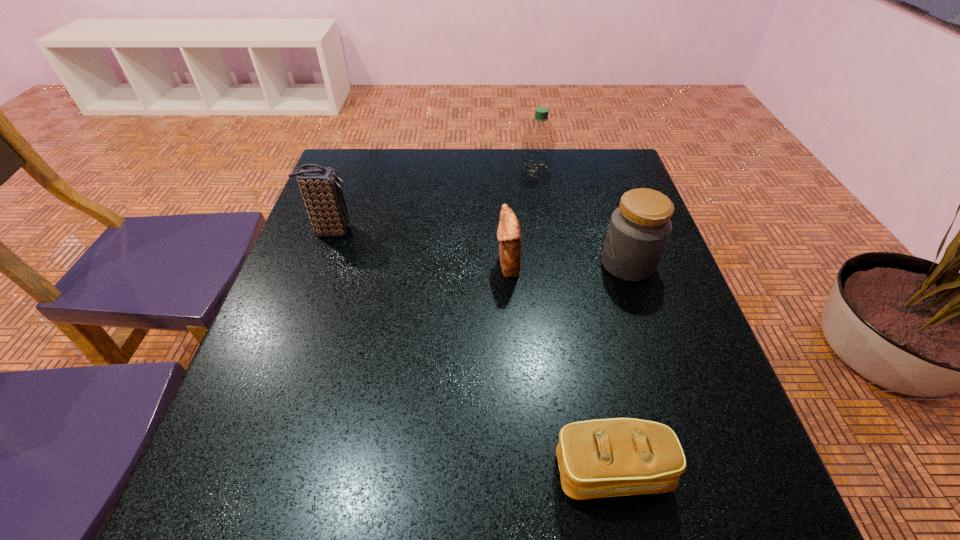
Select which object appears as the third closest to the second clutch bag from left to right. Please provide its 2D coordinates. Your answer should be formatted as a tuple, i.e. [(x, y)], where the tuple contains the x and y coordinates of a point satisfying the conditions above.

[(321, 189)]

The image size is (960, 540). Identify the location of the closest clutch bag to the farthest object. (509, 234).

At what (x,y) coordinates should I click in order to perform the action: click on the closest clutch bag to the second farthest object. Please return your answer as a coordinate pair (x, y). Looking at the image, I should click on (509, 234).

The width and height of the screenshot is (960, 540). What are the coordinates of `free point that satisfies the following two spatial constraints: 1. on the surface of the jar near the warning symbol; 2. on the zipper side of the shortest clutch bag` in the screenshot? It's located at (696, 470).

Identify the location of free space in the image that satisfies the following two spatial constraints: 1. on the front side of the water bottle; 2. on the open side of the second tallest clutch bag. The width and height of the screenshot is (960, 540). (551, 265).